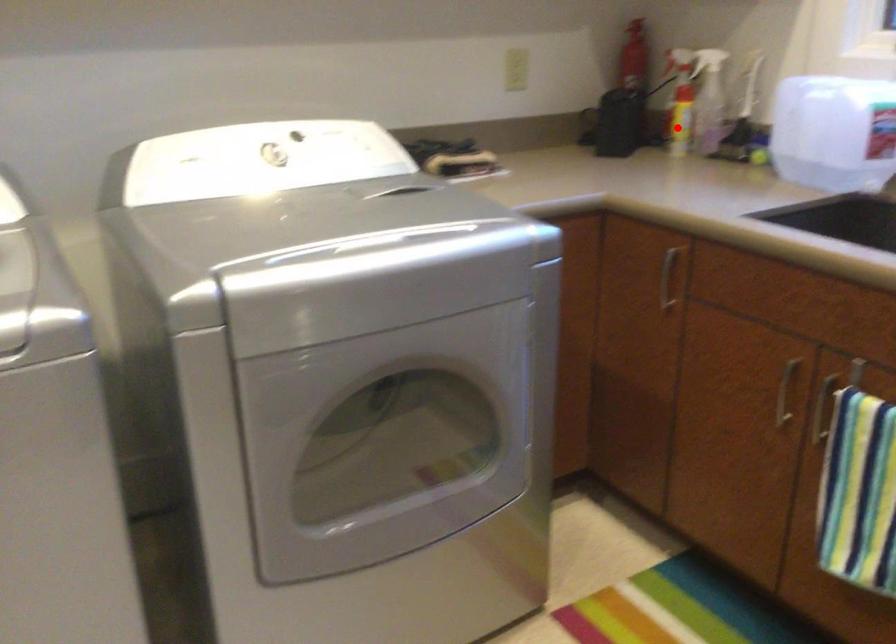
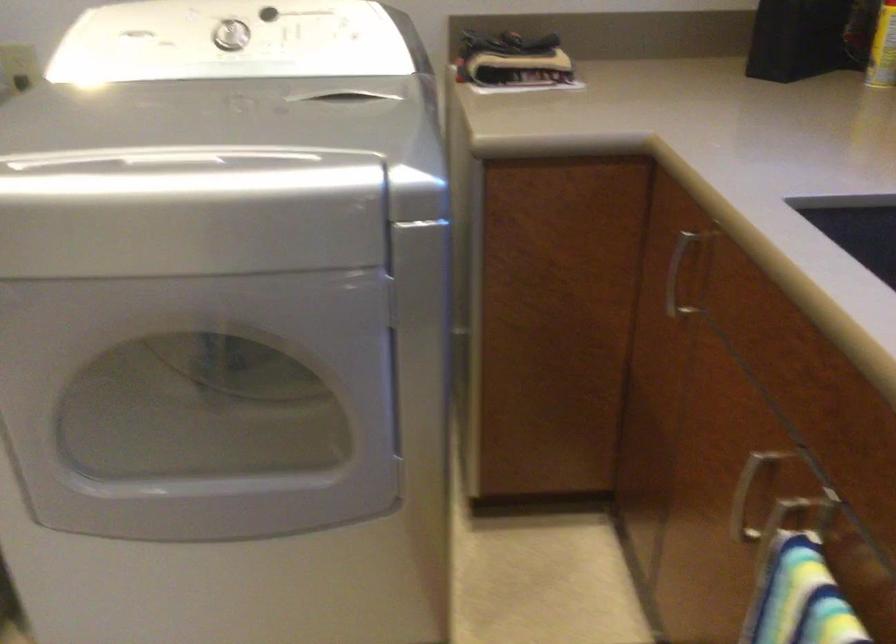
Question: I am providing you with two images of the same scene from different viewpoints. A red point is marked on the first image. Can you still see the location of the red point in image 2?

Choices:
 (A) Yes
 (B) No

Answer: (A)